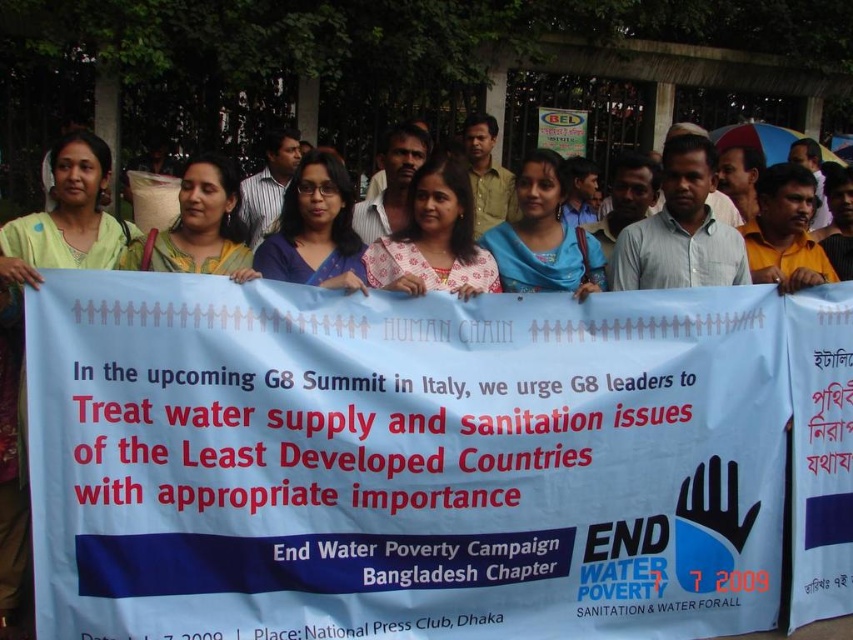
What is the relationship between the white paper banner at center and the blue fabric banner at center in terms of their vertical positioning?

The white paper banner at center is positioned below the blue fabric banner at center.

What is the relationship between the white paper banner at center and the blue fabric banner at center in terms of their positioning?

The white paper banner at center is in front of the blue fabric banner at center.